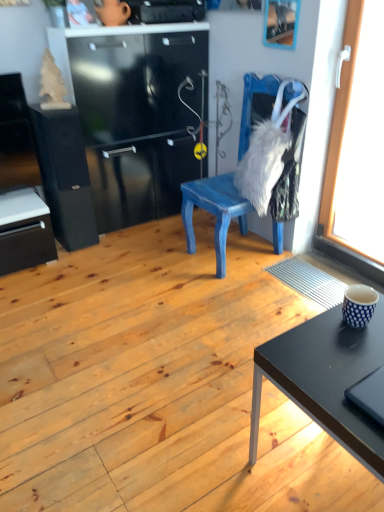
Question: Does transparent glass window at right have a smaller size compared to black matte file cabinet at left?

Choices:
 (A) yes
 (B) no

Answer: (A)

Question: From the image's perspective, is transparent glass window at right located above black matte file cabinet at left?

Choices:
 (A) yes
 (B) no

Answer: (A)

Question: From a real-world perspective, is transparent glass window at right on top of black matte file cabinet at left?

Choices:
 (A) no
 (B) yes

Answer: (B)

Question: Would you say black matte file cabinet at left is part of transparent glass window at right's contents?

Choices:
 (A) yes
 (B) no

Answer: (B)

Question: Is transparent glass window at right further to camera compared to black matte file cabinet at left?

Choices:
 (A) no
 (B) yes

Answer: (A)

Question: Based on their sizes in the image, would you say blue painted wood chair at center is bigger or smaller than black matte file cabinet at left?

Choices:
 (A) big
 (B) small

Answer: (A)

Question: From the image's perspective, relative to black matte file cabinet at left, is blue painted wood chair at center above or below?

Choices:
 (A) above
 (B) below

Answer: (B)

Question: Is point (256, 76) positioned closer to the camera than point (62, 237)?

Choices:
 (A) farther
 (B) closer

Answer: (B)

Question: From a real-world perspective, is blue painted wood chair at center physically located above or below black matte file cabinet at left?

Choices:
 (A) above
 (B) below

Answer: (A)

Question: Would you say black matte laptop at lower right is inside or outside blue painted wood chair at center?

Choices:
 (A) outside
 (B) inside

Answer: (A)

Question: In terms of size, does black matte laptop at lower right appear bigger or smaller than blue painted wood chair at center?

Choices:
 (A) big
 (B) small

Answer: (B)

Question: In terms of height, does black matte laptop at lower right look taller or shorter compared to blue painted wood chair at center?

Choices:
 (A) short
 (B) tall

Answer: (A)

Question: Does point (380, 392) appear closer or farther from the camera than point (296, 211)?

Choices:
 (A) farther
 (B) closer

Answer: (B)

Question: In terms of height, does black matte file cabinet at left look taller or shorter compared to wooden picture frame at upper center?

Choices:
 (A) short
 (B) tall

Answer: (B)

Question: From the image's perspective, is black matte file cabinet at left located above or below wooden picture frame at upper center?

Choices:
 (A) below
 (B) above

Answer: (A)